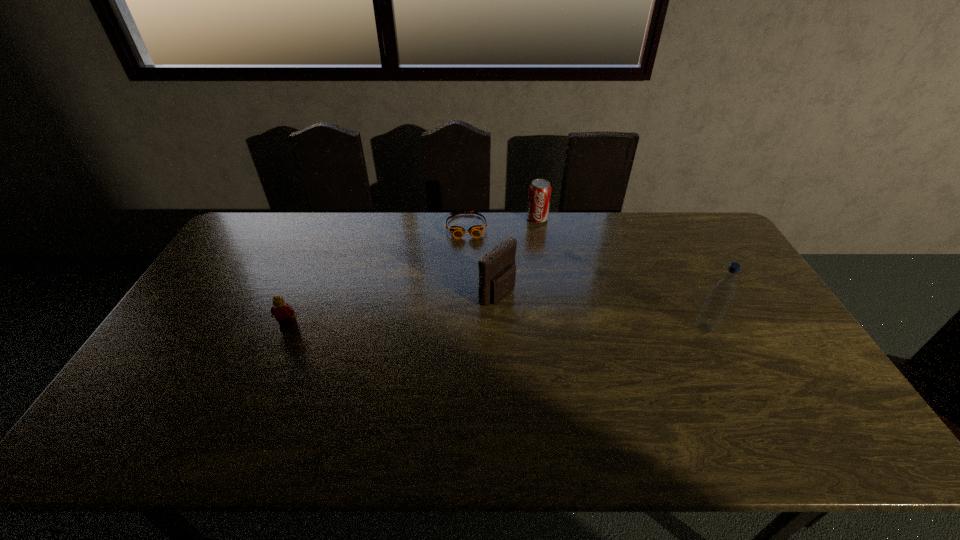
At what (x,y) coordinates should I click in order to perform the action: click on the leftmost object. Please return your answer as a coordinate pair (x, y). The height and width of the screenshot is (540, 960). Looking at the image, I should click on (285, 315).

Where is `Lego`? Lego is located at coordinates (285, 315).

The height and width of the screenshot is (540, 960). Identify the location of the rightmost object. (722, 291).

Find the location of a particular element. The width and height of the screenshot is (960, 540). water bottle is located at coordinates (722, 291).

Locate an element on the screen. This screenshot has height=540, width=960. the third farthest object is located at coordinates (497, 271).

Where is `the shortest object`? The height and width of the screenshot is (540, 960). the shortest object is located at coordinates (457, 232).

Where is `the third shortest object`? This screenshot has width=960, height=540. the third shortest object is located at coordinates (540, 190).

Find the location of a particular element. soda can is located at coordinates (540, 190).

Identify the location of blank space located 0.130m on the face of the Lego. The width and height of the screenshot is (960, 540). (271, 367).

Where is `free region located 0.100m on the front of the water bottle`? Image resolution: width=960 pixels, height=540 pixels. free region located 0.100m on the front of the water bottle is located at coordinates (723, 365).